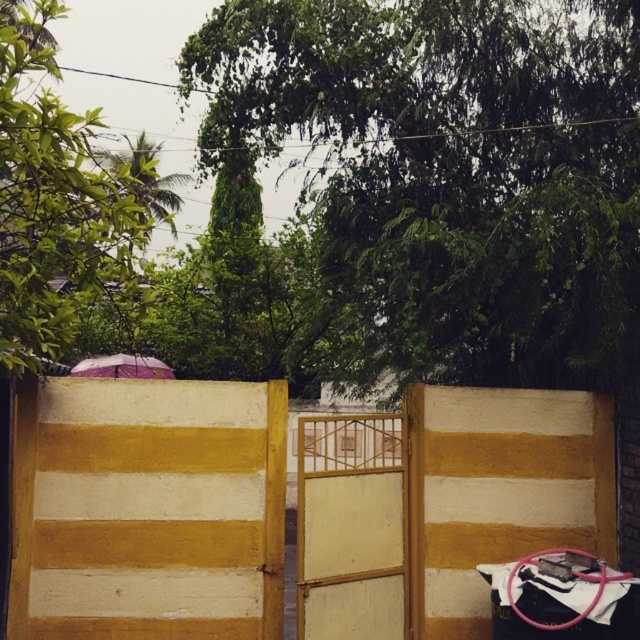
You are standing at point (352, 528) in the image. What object are you directly in front of?

You are directly in front of the wooden gate at center.

You are standing in front of the yellow and white striped wall. You see the wooden gate at center and the pink fabric umbrella at upper center. Which object is taller?

The wooden gate at center is much taller than the pink fabric umbrella at upper center.